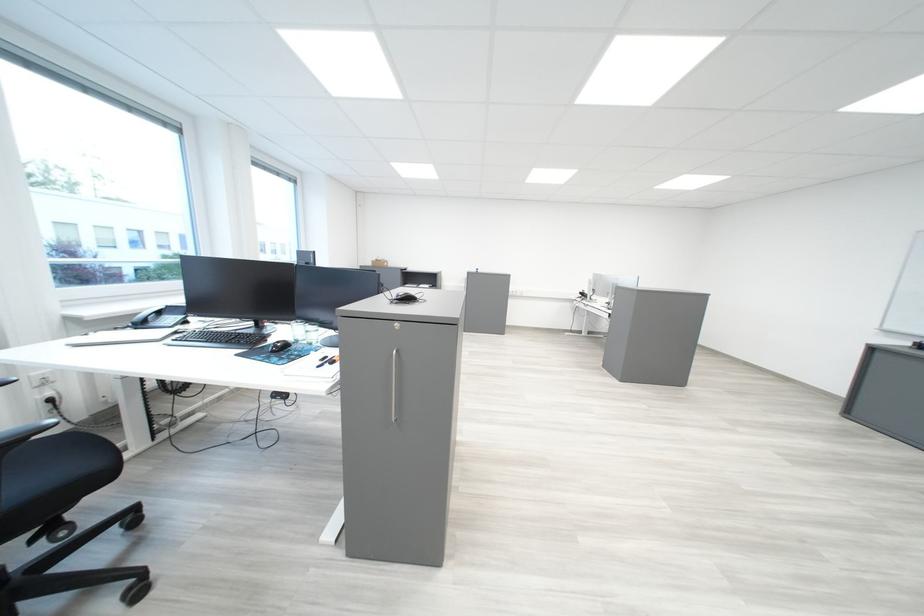
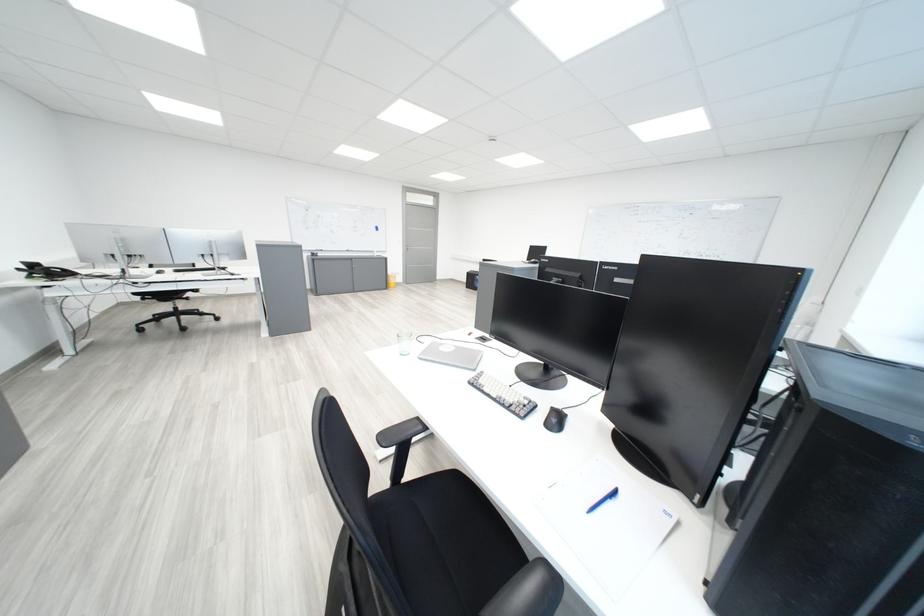
Question: I am providing you with two images of the same scene from different viewpoints. After the viewpoint changes to image2, which objects are now occluded?

Choices:
 (A) black computer mouse
 (B) black chair armrest
 (C) clear drinking glass
 (D) desk height button

Answer: (C)